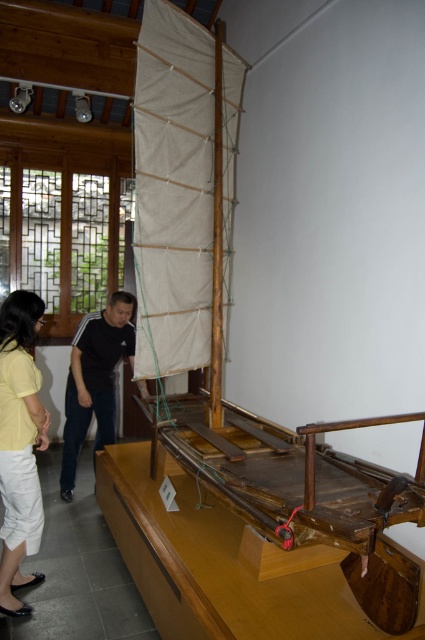
Question: In this image, where is yellow cotton shirt at lower left located relative to black cotton shirt at center?

Choices:
 (A) right
 (B) left

Answer: (B)

Question: Among these objects, which one is nearest to the camera?

Choices:
 (A) yellow cotton shirt at lower left
 (B) black cotton shirt at center

Answer: (A)

Question: Can you confirm if yellow cotton shirt at lower left is positioned above black cotton shirt at center?

Choices:
 (A) no
 (B) yes

Answer: (A)

Question: Is yellow cotton shirt at lower left positioned in front of black cotton shirt at center?

Choices:
 (A) no
 (B) yes

Answer: (B)

Question: Among these objects, which one is nearest to the camera?

Choices:
 (A) yellow cotton shirt at lower left
 (B) black cotton shirt at center

Answer: (A)